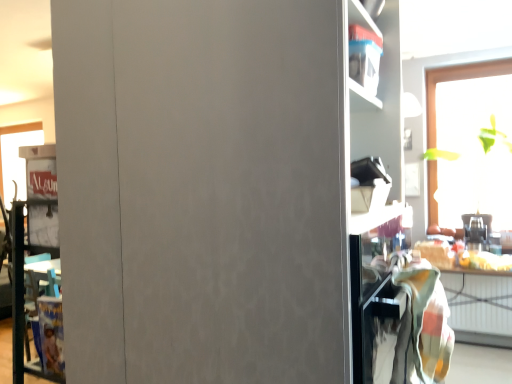
Question: From the image's perspective, is transparent glass window at upper right located beneath matte gray cabinet at center?

Choices:
 (A) yes
 (B) no

Answer: (B)

Question: Does transparent glass window at upper right appear on the right side of matte gray cabinet at center?

Choices:
 (A) no
 (B) yes

Answer: (B)

Question: Is transparent glass window at upper right next to matte gray cabinet at center?

Choices:
 (A) no
 (B) yes

Answer: (A)

Question: Is transparent glass window at upper right to the left of matte gray cabinet at center from the viewer's perspective?

Choices:
 (A) yes
 (B) no

Answer: (B)

Question: Is transparent glass window at upper right smaller than matte gray cabinet at center?

Choices:
 (A) no
 (B) yes

Answer: (B)

Question: Is transparent glass window at upper right looking in the opposite direction of matte gray cabinet at center?

Choices:
 (A) yes
 (B) no

Answer: (B)

Question: Considering the relative positions of metallic silver toaster at right and transparent glass window at upper right in the image provided, is metallic silver toaster at right to the left of transparent glass window at upper right from the viewer's perspective?

Choices:
 (A) no
 (B) yes

Answer: (B)

Question: Is metallic silver toaster at right directly adjacent to transparent glass window at upper right?

Choices:
 (A) yes
 (B) no

Answer: (B)

Question: Does metallic silver toaster at right have a greater height compared to transparent glass window at upper right?

Choices:
 (A) yes
 (B) no

Answer: (B)

Question: From a real-world perspective, does metallic silver toaster at right stand above transparent glass window at upper right?

Choices:
 (A) no
 (B) yes

Answer: (A)

Question: Would you say metallic silver toaster at right is outside transparent glass window at upper right?

Choices:
 (A) yes
 (B) no

Answer: (A)

Question: Is metallic silver toaster at right far away from transparent glass window at upper right?

Choices:
 (A) yes
 (B) no

Answer: (B)

Question: From the image's perspective, would you say transparent glass window at upper right is shown under multicolored woven blanket at right?

Choices:
 (A) no
 (B) yes

Answer: (A)